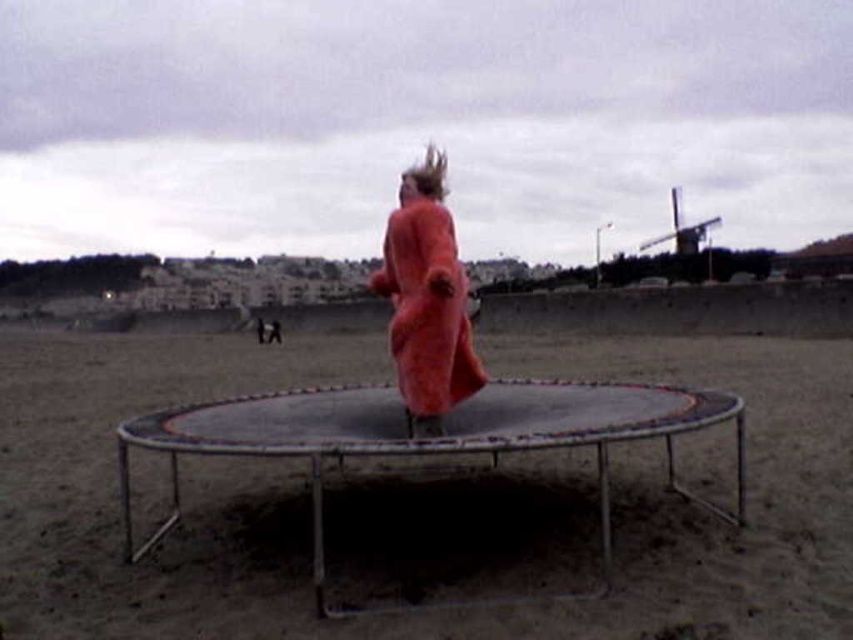
You are designing a safety mat for the trampoline area. The mat must cover the entire area of the brown sandy dirt at center and the fuzzy coral coat at center. Which object requires a larger mat based on their widths?

The brown sandy dirt at center requires a larger mat because its width is greater than that of the fuzzy coral coat at center.

From the picture: You are planning to build a small garden on the brown sandy dirt at center and the fuzzy coral coat at center. Which area has more space available for planting?

The fuzzy coral coat at center has more space available for planting because it occupies more space than the brown sandy dirt at center according to the description.

You are a drone operator trying to capture the trampoline scene. The trampoline is located at the center of the image. To ensure proper framing, you need to know the exact coordinates of the brown sandy dirt at center. What are its coordinates?

The brown sandy dirt at center is located at point (308, 502).